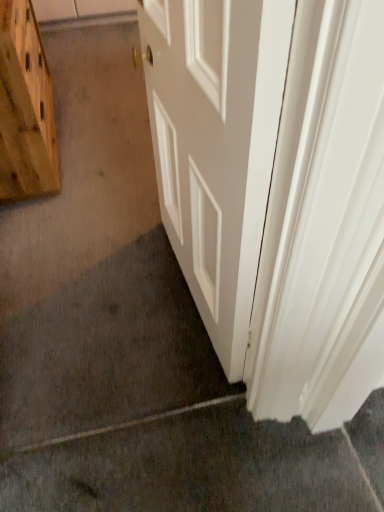
Question: Does gray carpet at lower left have a greater width compared to white smooth door at center?

Choices:
 (A) no
 (B) yes

Answer: (B)

Question: Considering the relative sizes of gray carpet at lower left and white smooth door at center in the image provided, is gray carpet at lower left shorter than white smooth door at center?

Choices:
 (A) yes
 (B) no

Answer: (A)

Question: From a real-world perspective, is gray carpet at lower left below white smooth door at center?

Choices:
 (A) yes
 (B) no

Answer: (A)

Question: Is white smooth door at center surrounded by gray carpet at lower left?

Choices:
 (A) no
 (B) yes

Answer: (A)

Question: Is gray carpet at lower left taller than white smooth door at center?

Choices:
 (A) no
 (B) yes

Answer: (A)

Question: From the image's perspective, is white smooth door at center positioned above or below wooden cutting board at left?

Choices:
 (A) above
 (B) below

Answer: (B)

Question: Is white smooth door at center inside or outside of wooden cutting board at left?

Choices:
 (A) inside
 (B) outside

Answer: (B)

Question: Based on their sizes in the image, would you say white smooth door at center is bigger or smaller than wooden cutting board at left?

Choices:
 (A) small
 (B) big

Answer: (A)

Question: Is white smooth door at center wider or thinner than wooden cutting board at left?

Choices:
 (A) thin
 (B) wide

Answer: (B)

Question: Looking at their shapes, would you say white smooth door at center is wider or thinner than gray carpet at lower left?

Choices:
 (A) thin
 (B) wide

Answer: (A)

Question: From the image's perspective, is white smooth door at center located above or below gray carpet at lower left?

Choices:
 (A) above
 (B) below

Answer: (A)

Question: Which is correct: white smooth door at center is inside gray carpet at lower left, or outside of it?

Choices:
 (A) outside
 (B) inside

Answer: (A)

Question: Is white smooth door at center taller or shorter than gray carpet at lower left?

Choices:
 (A) tall
 (B) short

Answer: (A)

Question: In terms of height, does gray carpet at lower left look taller or shorter compared to wooden cutting board at left?

Choices:
 (A) short
 (B) tall

Answer: (A)

Question: From the image's perspective, is gray carpet at lower left positioned above or below wooden cutting board at left?

Choices:
 (A) below
 (B) above

Answer: (A)